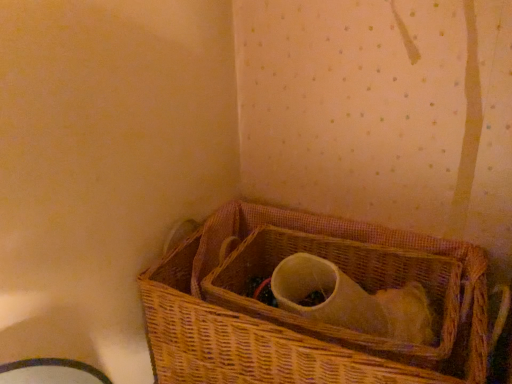
Where is `woven brown picnic basket at lower right`? The height and width of the screenshot is (384, 512). woven brown picnic basket at lower right is located at coordinates (298, 318).

What is the approximate width of woven brown picnic basket at lower right?

40.23 centimeters.

The height and width of the screenshot is (384, 512). What do you see at coordinates (298, 318) in the screenshot? I see `woven brown picnic basket at lower right` at bounding box center [298, 318].

Find the location of `woven brown picnic basket at lower right`. woven brown picnic basket at lower right is located at coordinates (298, 318).